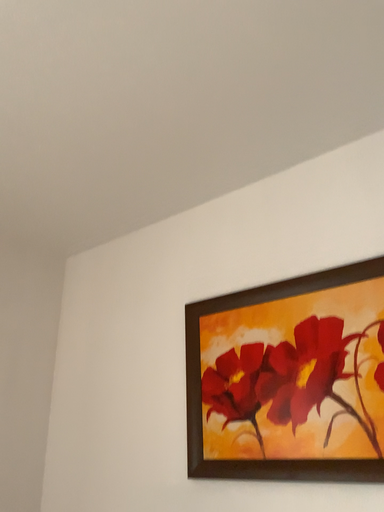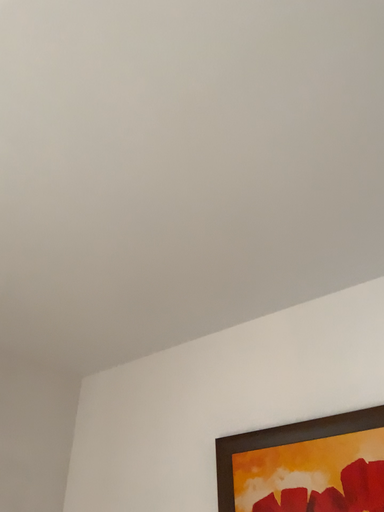
Question: How did the camera likely rotate when shooting the video?

Choices:
 (A) rotated downward
 (B) rotated upward

Answer: (B)